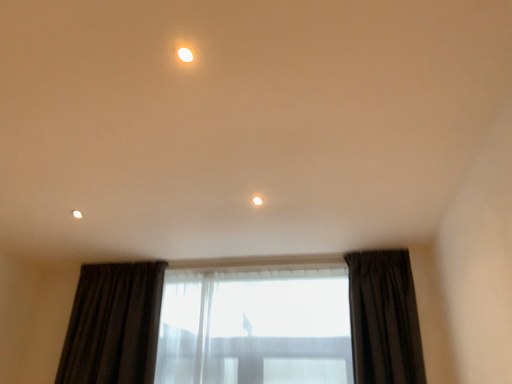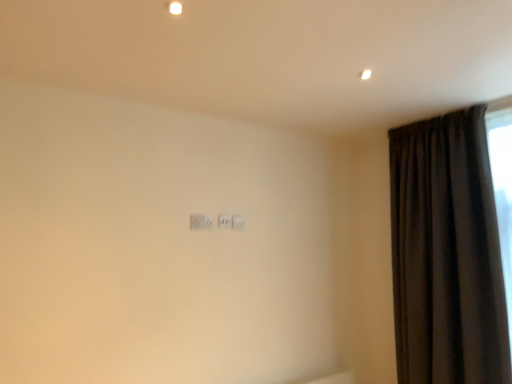
Question: How did the camera likely rotate when shooting the video?

Choices:
 (A) rotated downward
 (B) rotated upward

Answer: (A)